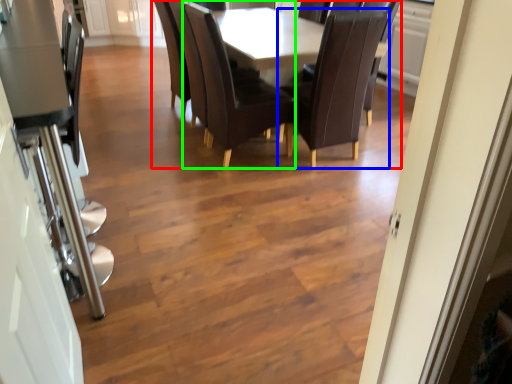
Question: Estimate the real-world distances between objects in this image. Which object is closer to kitchen & dining room table (highlighted by a red box), chair (highlighted by a blue box) or chair (highlighted by a green box)?

Choices:
 (A) chair
 (B) chair

Answer: (B)